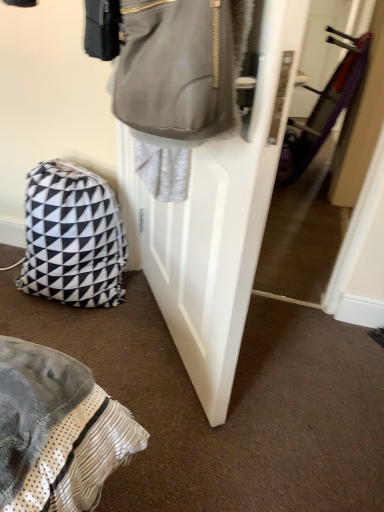
Where is `black and white geometric fabric backpack at lower left`? black and white geometric fabric backpack at lower left is located at coordinates (72, 237).

Measure the distance between black and white geometric fabric backpack at lower left and camera.

4.82 feet.

Describe the element at coordinates (72, 237) in the screenshot. I see `black and white geometric fabric backpack at lower left` at that location.

What do you see at coordinates (216, 218) in the screenshot?
I see `matte gray door at center` at bounding box center [216, 218].

I want to click on matte gray door at center, so click(x=216, y=218).

Locate an element on the screen. The image size is (384, 512). black and white geometric fabric backpack at lower left is located at coordinates (72, 237).

Can you confirm if matte gray door at center is positioned to the left of black and white geometric fabric backpack at lower left?

No.

Does matte gray door at center lie in front of black and white geometric fabric backpack at lower left?

Yes, matte gray door at center is closer to the camera.

Which is more distant, (166, 238) or (32, 217)?

The point (32, 217) is more distant.

Consider the image. From the image's perspective, is matte gray door at center below black and white geometric fabric backpack at lower left?

No, from the image's perspective, matte gray door at center is not beneath black and white geometric fabric backpack at lower left.

From a real-world perspective, is matte gray door at center located higher than black and white geometric fabric backpack at lower left?

Indeed, from a real-world perspective, matte gray door at center stands above black and white geometric fabric backpack at lower left.

Considering the relative sizes of matte gray door at center and black and white geometric fabric backpack at lower left in the image provided, is matte gray door at center thinner than black and white geometric fabric backpack at lower left?

Yes, matte gray door at center is thinner than black and white geometric fabric backpack at lower left.

Which of these two, matte gray door at center or black and white geometric fabric backpack at lower left, stands taller?

matte gray door at center is taller.

Considering the sizes of objects matte gray door at center and black and white geometric fabric backpack at lower left in the image provided, who is smaller, matte gray door at center or black and white geometric fabric backpack at lower left?

Smaller between the two is black and white geometric fabric backpack at lower left.

Is matte gray door at center not inside black and white geometric fabric backpack at lower left?

Yes, matte gray door at center is located beyond the bounds of black and white geometric fabric backpack at lower left.

Does matte gray door at center touch black and white geometric fabric backpack at lower left?

They are not placed beside each other.

Could you tell me if matte gray door at center is facing black and white geometric fabric backpack at lower left?

No, matte gray door at center is not facing towards black and white geometric fabric backpack at lower left.

What's the angular difference between matte gray door at center and black and white geometric fabric backpack at lower left's facing directions?

The facing directions of matte gray door at center and black and white geometric fabric backpack at lower left are 118 degrees apart.

Locate an element on the screen. Image resolution: width=384 pixels, height=512 pixels. door on the right side of black and white geometric fabric backpack at lower left is located at coordinates (216, 218).

Considering the relative positions of black and white geometric fabric backpack at lower left and matte gray door at center in the image provided, is black and white geometric fabric backpack at lower left to the left or to the right of matte gray door at center?

In the image, black and white geometric fabric backpack at lower left appears on the left side of matte gray door at center.

Considering the positions of objects black and white geometric fabric backpack at lower left and matte gray door at center in the image provided, who is behind, black and white geometric fabric backpack at lower left or matte gray door at center?

black and white geometric fabric backpack at lower left is further away from the camera.

Considering the positions of point (114, 216) and point (279, 153), is point (114, 216) closer or farther from the camera than point (279, 153)?

Clearly, point (114, 216) is more distant from the camera than point (279, 153).

Looking at this image, from the image's perspective, between black and white geometric fabric backpack at lower left and matte gray door at center, which one is located above?

matte gray door at center, from the image's perspective.

From a real-world perspective, does black and white geometric fabric backpack at lower left sit lower than matte gray door at center?

Yes, from a real-world perspective, black and white geometric fabric backpack at lower left is below matte gray door at center.

Between black and white geometric fabric backpack at lower left and matte gray door at center, which one has smaller width?

matte gray door at center is thinner.

Is black and white geometric fabric backpack at lower left shorter than matte gray door at center?

Indeed, black and white geometric fabric backpack at lower left has a lesser height compared to matte gray door at center.

Can you confirm if black and white geometric fabric backpack at lower left is smaller than matte gray door at center?

Indeed, black and white geometric fabric backpack at lower left has a smaller size compared to matte gray door at center.

In the scene shown: Is black and white geometric fabric backpack at lower left not inside matte gray door at center?

Indeed, black and white geometric fabric backpack at lower left is completely outside matte gray door at center.

From the picture: Is black and white geometric fabric backpack at lower left directly adjacent to matte gray door at center?

No, black and white geometric fabric backpack at lower left is not making contact with matte gray door at center.

Is black and white geometric fabric backpack at lower left turned away from matte gray door at center?

No.

What's the angular difference between black and white geometric fabric backpack at lower left and matte gray door at center's facing directions?

black and white geometric fabric backpack at lower left and matte gray door at center are facing 118 degrees away from each other.

Image resolution: width=384 pixels, height=512 pixels. I want to click on door located above the black and white geometric fabric backpack at lower left (from the image's perspective), so click(x=216, y=218).

This screenshot has width=384, height=512. I want to click on backpack that appears below the matte gray door at center (from a real-world perspective), so click(72, 237).

Where is `backpack behind the matte gray door at center`? backpack behind the matte gray door at center is located at coordinates pos(72,237).